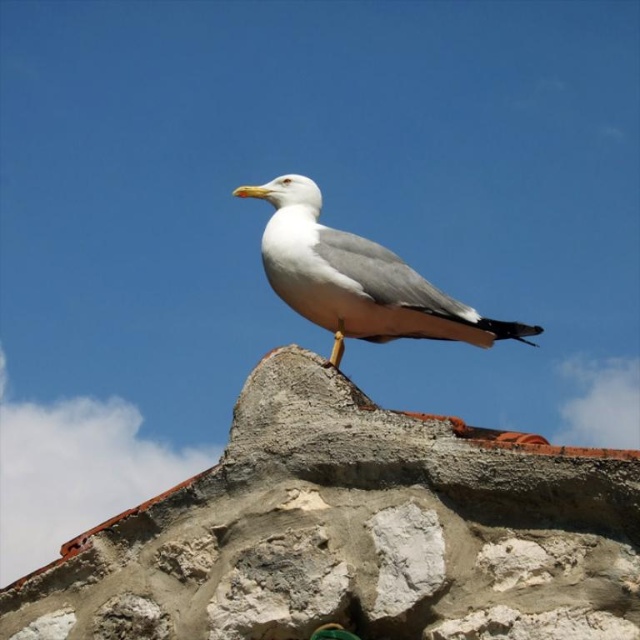
You are a photographer aiming to capture the white feathered seagull at center. However, you notice the rough concrete stone at center might block your view. Based on the scene, can you determine if the stone is in front of or behind the seagull?

The rough concrete stone at center is in front of the white feathered seagull at center, so it will block the view of the seagull.

You are standing at the camera position and want to throw a small pebble to hit the rough concrete stone at center. Is the distance feasible for an average person?

The rough concrete stone at center is 148.59 feet away from the camera. An average person can throw a pebble about 100 feet, so it is not feasible to hit the stone with a pebble from this distance.